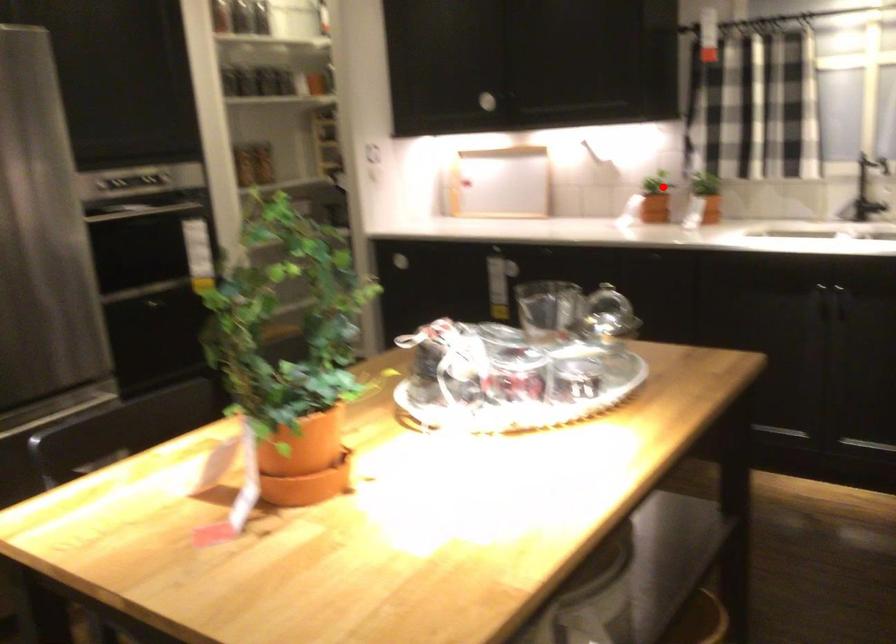
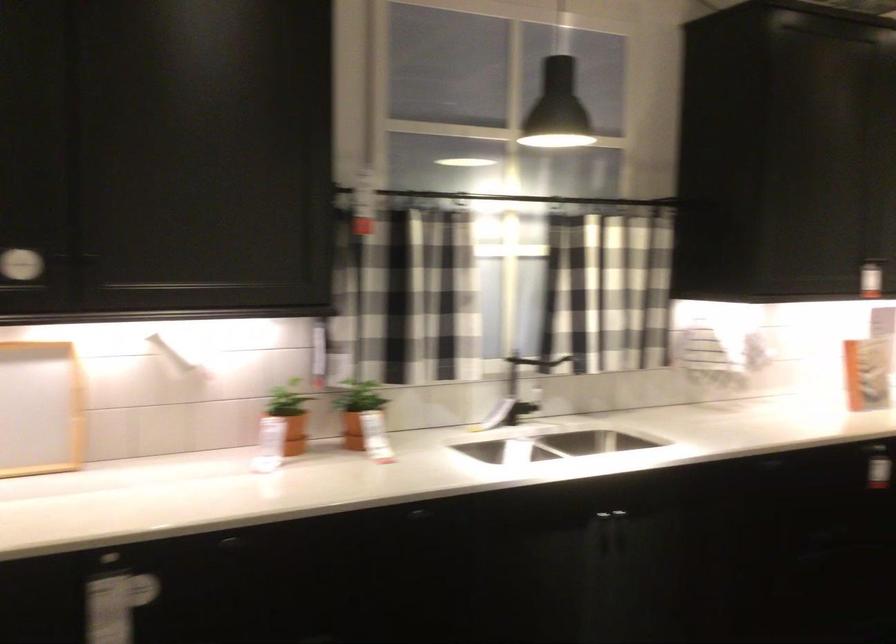
Question: I am providing you with two images of the same scene from different viewpoints. Given a red point in image1, look at the same physical point in image2. Is it:

Choices:
 (A) Closer to the viewpoint
 (B) Farther from the viewpoint

Answer: (A)